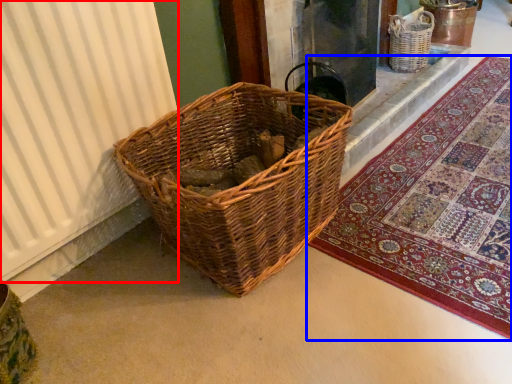
Question: Which object is further to the camera taking this photo, curtain (highlighted by a red box) or mat (highlighted by a blue box)?

Choices:
 (A) curtain
 (B) mat

Answer: (B)